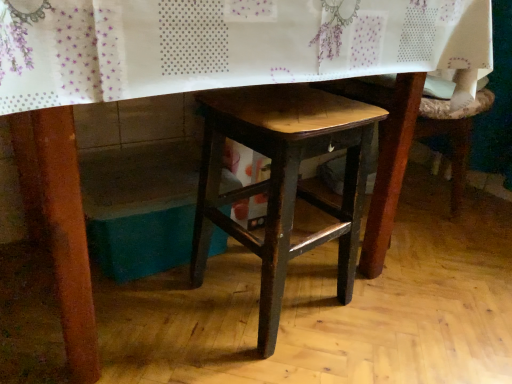
Where is `vacant space that is to the left of wooden stool at center`? This screenshot has width=512, height=384. vacant space that is to the left of wooden stool at center is located at coordinates (156, 307).